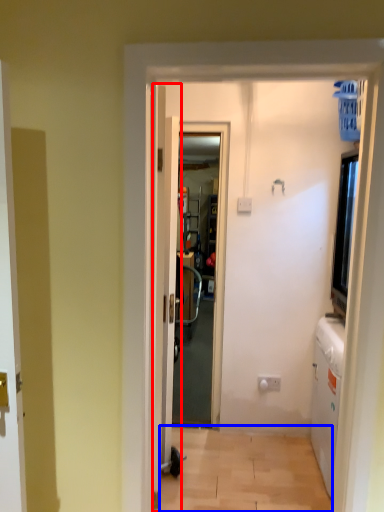
Question: Which object is further to the camera taking this photo, door (highlighted by a red box) or corridor (highlighted by a blue box)?

Choices:
 (A) door
 (B) corridor

Answer: (A)